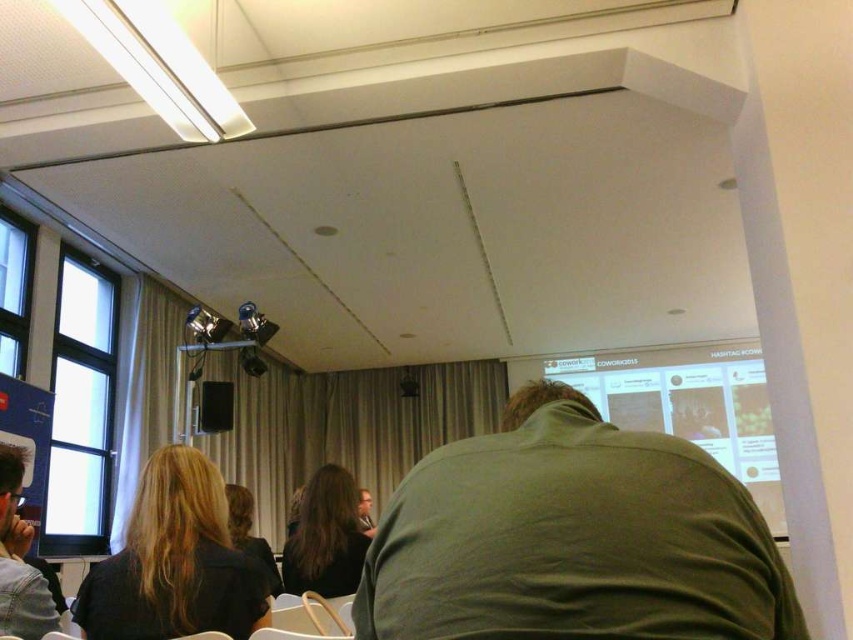
Is point (134, 556) positioned in front of point (39, 627)?

Yes, point (134, 556) is in front of point (39, 627).

Image resolution: width=853 pixels, height=640 pixels. What do you see at coordinates (173, 561) in the screenshot?
I see `dark brown hair at lower left` at bounding box center [173, 561].

Identify the location of dark brown hair at lower left. Image resolution: width=853 pixels, height=640 pixels. (173, 561).

Is green matte shirt at center bigger than matte white projection screen at upper right?

No, green matte shirt at center is not bigger than matte white projection screen at upper right.

Which is above, green matte shirt at center or matte white projection screen at upper right?

green matte shirt at center

The height and width of the screenshot is (640, 853). Identify the location of green matte shirt at center. (572, 538).

Who is taller, matte white projection screen at upper right or matte black jacket at lower left?

With more height is matte white projection screen at upper right.

Can you confirm if matte white projection screen at upper right is wider than matte black jacket at lower left?

Yes, matte white projection screen at upper right is wider than matte black jacket at lower left.

Describe the element at coordinates (689, 404) in the screenshot. I see `matte white projection screen at upper right` at that location.

Identify the location of matte white projection screen at upper right. The image size is (853, 640). (689, 404).